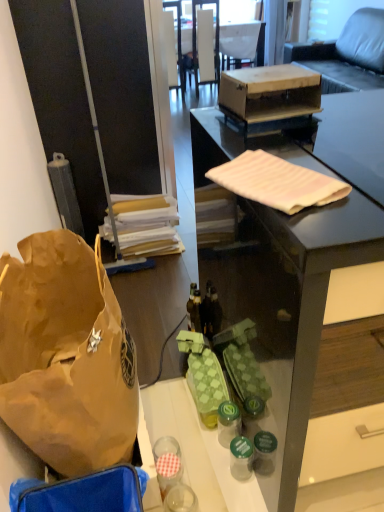
Question: In terms of size, does brown paper bag at left appear bigger or smaller than white fabric armchair at upper center?

Choices:
 (A) small
 (B) big

Answer: (A)

Question: From a real-world perspective, relative to white fabric armchair at upper center, is brown paper bag at left vertically above or below?

Choices:
 (A) above
 (B) below

Answer: (B)

Question: Which object is the farthest from the brown paper bag at left?

Choices:
 (A) matte black desk at center
 (B) wooden box at center
 (C) white glossy chair at upper center
 (D) white fabric armchair at upper center
 (E) translucent plastic bottle at center, placed as the first bottle when sorted from back to front

Answer: (D)

Question: Estimate the real-world distances between objects in this image. Which object is closer to the green plastic bottle at center, placed as the second bottle when sorted from bottom to top?

Choices:
 (A) white glossy chair at upper center
 (B) translucent plastic bottle at center, the 3th bottle from the bottom
 (C) green glass bottle at lower center, which is counted as the 1th bottle, starting from the front
 (D) leather couch at upper right
 (E) matte black desk at center

Answer: (C)